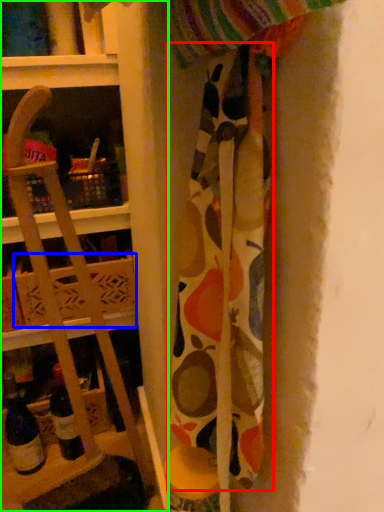
Question: Which object is the farthest from fabric (highlighted by a red box)? Choose among these: cardboard box (highlighted by a blue box) or shelf (highlighted by a green box).

Choices:
 (A) cardboard box
 (B) shelf

Answer: (A)